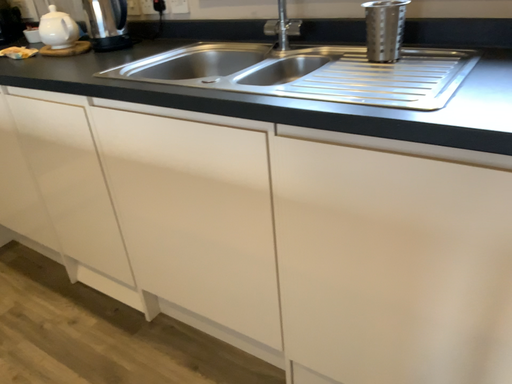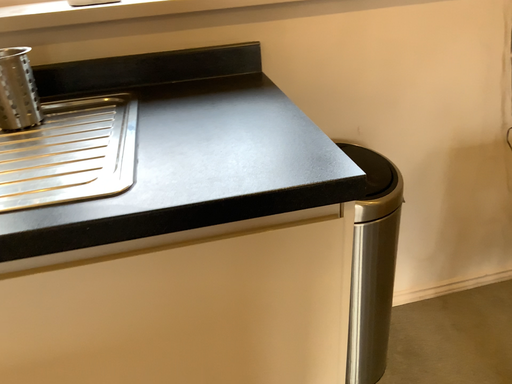
Question: Which way did the camera rotate in the video?

Choices:
 (A) rotated downward
 (B) rotated upward

Answer: (B)